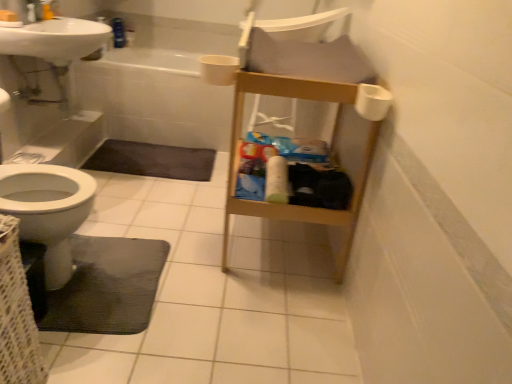
Identify the location of woven fabric basket at lower left. The height and width of the screenshot is (384, 512). (17, 315).

Describe the element at coordinates (108, 286) in the screenshot. The image size is (512, 384). I see `black rubber bath mat at lower left, which is the 1th bath mat in front-to-back order` at that location.

Where is `white matte toilet paper at center, the 2th toilet paper from the front`? This screenshot has width=512, height=384. white matte toilet paper at center, the 2th toilet paper from the front is located at coordinates (276, 180).

Is white glossy sink at upper left facing towards woven fabric basket at lower left?

No, white glossy sink at upper left is not oriented towards woven fabric basket at lower left.

Which object is thinner, white glossy sink at upper left or woven fabric basket at lower left?

With smaller width is woven fabric basket at lower left.

Where is `basket below the white glossy sink at upper left (from the image's perspective)`? Image resolution: width=512 pixels, height=384 pixels. basket below the white glossy sink at upper left (from the image's perspective) is located at coordinates (17, 315).

Is white matte toilet paper at center, arranged as the second toilet paper when viewed from the top, aimed at dark gray matte bath mat at lower left, the first bath mat from the top?

No, white matte toilet paper at center, arranged as the second toilet paper when viewed from the top, is not turned towards dark gray matte bath mat at lower left, the first bath mat from the top.

Which object is wider, white matte toilet paper at center, acting as the 1th toilet paper starting from the left, or dark gray matte bath mat at lower left, which appears as the second bath mat when ordered from the bottom?

Wider between the two is dark gray matte bath mat at lower left, which appears as the second bath mat when ordered from the bottom.

Starting from the white matte toilet paper at center, arranged as the first toilet paper when ordered from the bottom, which bath mat is the 2nd one to the left? Please provide its 2D coordinates.

[(152, 160)]

Who is smaller, white matte toilet paper at upper right, the first toilet paper positioned from the front, or white matte toilet paper at center, acting as the 1th toilet paper starting from the left?

white matte toilet paper at upper right, the first toilet paper positioned from the front.

In the scene shown: From a real-world perspective, is white matte toilet paper at upper right, which appears as the first toilet paper when viewed from the right, physically above white matte toilet paper at center, arranged as the first toilet paper when ordered from the bottom?

Yes.

Which point is more distant from viewer, (371, 102) or (274, 189)?

Point (274, 189)

Is white matte toilet paper at upper right, the first toilet paper positioned from the front, facing towards white matte toilet paper at center, the 1th toilet paper positioned from the back?

No.

Is point (355, 105) closer to camera compared to point (179, 176)?

Yes, point (355, 105) is closer to viewer.

Is white matte toilet paper at upper right, the 2th toilet paper positioned from the left, further to the viewer compared to dark gray matte bath mat at lower left, which is the second bath mat in front-to-back order?

No, white matte toilet paper at upper right, the 2th toilet paper positioned from the left, is in front of dark gray matte bath mat at lower left, which is the second bath mat in front-to-back order.

Is white matte toilet paper at upper right, the first toilet paper viewed from the top, oriented away from dark gray matte bath mat at lower left, the first bath mat from the top?

No, dark gray matte bath mat at lower left, the first bath mat from the top, is not at the back of white matte toilet paper at upper right, the first toilet paper viewed from the top.

Considering the relative positions of white matte toilet paper at upper right, the first toilet paper viewed from the top, and dark gray matte bath mat at lower left, which is the second bath mat in front-to-back order, in the image provided, is white matte toilet paper at upper right, the first toilet paper viewed from the top, to the right of dark gray matte bath mat at lower left, which is the second bath mat in front-to-back order, from the viewer's perspective?

Yes.

From a real-world perspective, is woven fabric basket at lower left on black rubber bath mat at lower left, which is the 1th bath mat in front-to-back order?

Yes, from a real-world perspective, woven fabric basket at lower left is above black rubber bath mat at lower left, which is the 1th bath mat in front-to-back order.

Is woven fabric basket at lower left wider than black rubber bath mat at lower left, which is counted as the 1th bath mat, starting from the bottom?

No.

Considering the points (2, 274) and (161, 254), which point is in front, point (2, 274) or point (161, 254)?

Point (2, 274)

Considering the sizes of objects woven fabric basket at lower left and black rubber bath mat at lower left, which is counted as the 1th bath mat, starting from the bottom, in the image provided, who is shorter, woven fabric basket at lower left or black rubber bath mat at lower left, which is counted as the 1th bath mat, starting from the bottom,?

black rubber bath mat at lower left, which is counted as the 1th bath mat, starting from the bottom.

Where is `bath mat positioned vertically above the dark gray matte bath mat at lower left, which appears as the second bath mat when ordered from the bottom (from a real-world perspective)`? The image size is (512, 384). bath mat positioned vertically above the dark gray matte bath mat at lower left, which appears as the second bath mat when ordered from the bottom (from a real-world perspective) is located at coordinates (108, 286).

Considering the relative sizes of dark gray matte bath mat at lower left, which appears as the second bath mat when ordered from the bottom, and black rubber bath mat at lower left, which is counted as the 1th bath mat, starting from the bottom, in the image provided, is dark gray matte bath mat at lower left, which appears as the second bath mat when ordered from the bottom, smaller than black rubber bath mat at lower left, which is counted as the 1th bath mat, starting from the bottom,?

Correct, dark gray matte bath mat at lower left, which appears as the second bath mat when ordered from the bottom, occupies less space than black rubber bath mat at lower left, which is counted as the 1th bath mat, starting from the bottom.

Considering the relative positions of dark gray matte bath mat at lower left, the first bath mat from the top, and black rubber bath mat at lower left, which is counted as the 1th bath mat, starting from the bottom, in the image provided, is dark gray matte bath mat at lower left, the first bath mat from the top, to the left or to the right of black rubber bath mat at lower left, which is counted as the 1th bath mat, starting from the bottom,?

From the image, it's evident that dark gray matte bath mat at lower left, the first bath mat from the top, is to the left of black rubber bath mat at lower left, which is counted as the 1th bath mat, starting from the bottom.

Consider the image. From the image's perspective, would you say white glossy sink at upper left is positioned over dark gray matte bath mat at lower left, which is the second bath mat in front-to-back order?

Indeed, from the image's perspective, white glossy sink at upper left is shown above dark gray matte bath mat at lower left, which is the second bath mat in front-to-back order.

How many degrees apart are the facing directions of white glossy sink at upper left and dark gray matte bath mat at lower left, the first bath mat from the top?

The angular difference between white glossy sink at upper left and dark gray matte bath mat at lower left, the first bath mat from the top, is 88.1 degrees.

Is point (58, 43) closer or farther from the camera than point (205, 171)?

Point (58, 43) appears to be closer to the viewer than point (205, 171).

In the scene shown: Who is shorter, white glossy sink at upper left or dark gray matte bath mat at lower left, the 1th bath mat in the back-to-front sequence?

With less height is dark gray matte bath mat at lower left, the 1th bath mat in the back-to-front sequence.

Identify the location of sink located on the left of woven fabric basket at lower left. (55, 39).

Find the location of a particular element. bath mat above the white matte toilet paper at center, arranged as the first toilet paper when ordered from the bottom (from the image's perspective) is located at coordinates (152, 160).

Estimate the real-world distances between objects in this image. Which object is closer to white matte toilet paper at upper right, the 2th toilet paper positioned from the left, white glossy sink at upper left or black rubber bath mat at lower left, which is counted as the 1th bath mat, starting from the bottom?

The object closer to white matte toilet paper at upper right, the 2th toilet paper positioned from the left, is black rubber bath mat at lower left, which is counted as the 1th bath mat, starting from the bottom.

When comparing their distances from black rubber bath mat at lower left, the second bath mat viewed from the top, does woven fabric basket at lower left or white glossy sink at upper left seem further?

white glossy sink at upper left lies further to black rubber bath mat at lower left, the second bath mat viewed from the top, than the other object.

Estimate the real-world distances between objects in this image. Which object is closer to white glossy bathtub at upper center, black rubber bath mat at lower left, which is the 1th bath mat in front-to-back order, or white glossy sink at upper left?

Among the two, white glossy sink at upper left is located nearer to white glossy bathtub at upper center.

Estimate the real-world distances between objects in this image. Which object is closer to white glossy sink at upper left, white glossy sink at upper left or white glossy bathtub at upper center?

white glossy sink at upper left is positioned closer to the anchor white glossy sink at upper left.

From the image, which object appears to be nearer to dark gray matte bath mat at lower left, which appears as the second bath mat when ordered from the bottom, woven fabric basket at lower left or white matte toilet paper at upper right, placed as the 2th toilet paper when sorted from bottom to top?

woven fabric basket at lower left is positioned closer to the anchor dark gray matte bath mat at lower left, which appears as the second bath mat when ordered from the bottom.

Estimate the real-world distances between objects in this image. Which object is further from white glossy sink at upper left, dark gray matte bath mat at lower left, the 1th bath mat in the back-to-front sequence, or white glossy bathtub at upper center?

Among the two, dark gray matte bath mat at lower left, the 1th bath mat in the back-to-front sequence, is located further to white glossy sink at upper left.

Which object lies nearer to the anchor point white matte toilet paper at center, the 1th toilet paper positioned from the back, white glossy sink at upper left or white matte toilet paper at upper right, the first toilet paper viewed from the top?

Among the two, white matte toilet paper at upper right, the first toilet paper viewed from the top, is located nearer to white matte toilet paper at center, the 1th toilet paper positioned from the back.

Estimate the real-world distances between objects in this image. Which object is further from white glossy sink at upper left, dark gray matte bath mat at lower left, the first bath mat from the top, or white matte toilet paper at upper right, placed as the 2th toilet paper when sorted from bottom to top?

Among the two, white matte toilet paper at upper right, placed as the 2th toilet paper when sorted from bottom to top, is located further to white glossy sink at upper left.

You are a GUI agent. You are given a task and a screenshot of the screen. Output one action in this format:
    pyautogui.click(x=<x>, y=<y>)
    Task: Click on the sink located between white glossy sink at upper left and white matte toilet paper at center, the 1th toilet paper positioned from the back, in the left-right direction
    The height and width of the screenshot is (384, 512).
    Given the screenshot: What is the action you would take?
    pyautogui.click(x=55, y=39)

Image resolution: width=512 pixels, height=384 pixels. Find the location of `toilet paper located between white matte toilet paper at upper right, the first toilet paper viewed from the top, and dark gray matte bath mat at lower left, which is the second bath mat in front-to-back order, in the depth direction`. toilet paper located between white matte toilet paper at upper right, the first toilet paper viewed from the top, and dark gray matte bath mat at lower left, which is the second bath mat in front-to-back order, in the depth direction is located at coordinates (276, 180).

Where is `bath mat between white matte toilet paper at center, acting as the 1th toilet paper starting from the left, and white glossy bathtub at upper center, along the z-axis`? The height and width of the screenshot is (384, 512). bath mat between white matte toilet paper at center, acting as the 1th toilet paper starting from the left, and white glossy bathtub at upper center, along the z-axis is located at coordinates (152, 160).

At what (x,y) coordinates should I click in order to perform the action: click on bath between white glossy sink at upper left and white matte toilet paper at upper right, which appears as the first toilet paper when viewed from the right, in the horizontal direction. Please return your answer as a coordinate pair (x, y). Looking at the image, I should click on (155, 98).